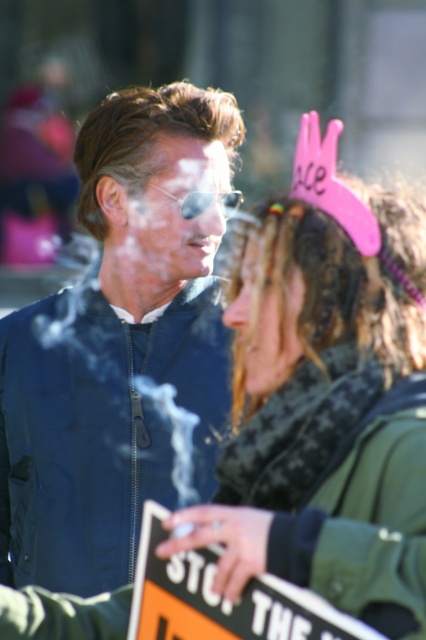
Between green textured scarf at center and matte black goggles at center, which one appears on the right side from the viewer's perspective?

green textured scarf at center

Does green textured scarf at center have a larger size compared to matte black goggles at center?

Correct, green textured scarf at center is larger in size than matte black goggles at center.

At what (x,y) coordinates should I click in order to perform the action: click on green textured scarf at center. Please return your answer as a coordinate pair (x, y). The height and width of the screenshot is (640, 426). Looking at the image, I should click on (316, 422).

Between green textured scarf at center and brown shiny hair at upper center, which one has more height?

With more height is green textured scarf at center.

Is green textured scarf at center further to the viewer compared to brown shiny hair at upper center?

That is False.

Find the location of a particular element. The image size is (426, 640). green textured scarf at center is located at coordinates (316, 422).

What do you see at coordinates (316, 422) in the screenshot? I see `green textured scarf at center` at bounding box center [316, 422].

Can you confirm if green textured scarf at center is positioned to the right of curly brown hair at center?

In fact, green textured scarf at center is to the left of curly brown hair at center.

Which is behind, point (412, 230) or point (259, 237)?

Point (259, 237)

I want to click on green textured scarf at center, so click(x=316, y=422).